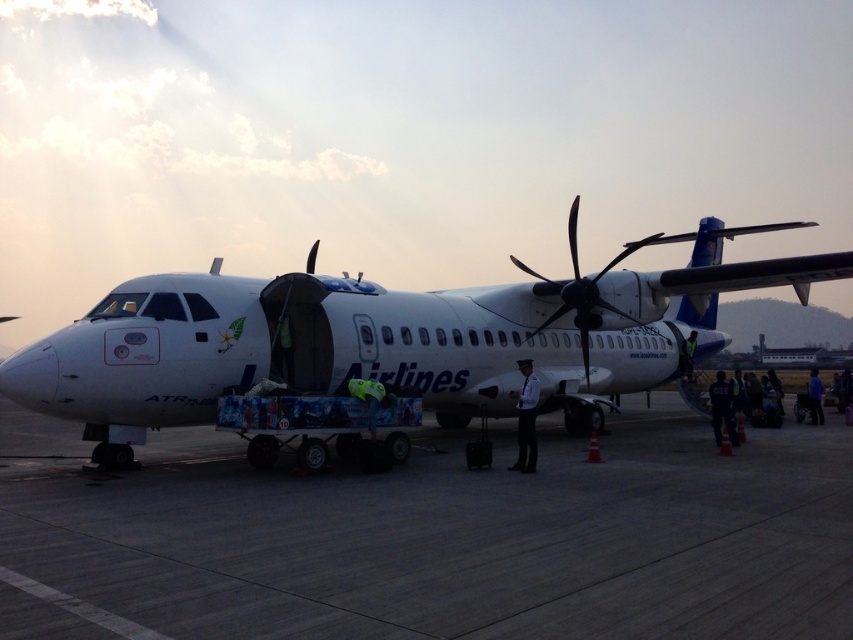
Which of these two, concrete tarmac at center or white matte airplane at center, stands taller?

Standing taller between the two is white matte airplane at center.

Is point (643, 516) closer to viewer compared to point (161, 401)?

Yes, it is.

Where is `concrete tarmac at center`? Image resolution: width=853 pixels, height=640 pixels. concrete tarmac at center is located at coordinates (465, 541).

Can you confirm if concrete tarmac at center is wider than black metallic propeller at center?

Yes.

Can you confirm if concrete tarmac at center is positioned below black metallic propeller at center?

Yes.

Does point (213, 490) come behind point (575, 224)?

No, it is in front of (575, 224).

The image size is (853, 640). In order to click on concrete tarmac at center in this screenshot , I will do `click(465, 541)`.

Between white matte airplane at center and black metallic propeller at center, which one appears on the right side from the viewer's perspective?

black metallic propeller at center is more to the right.

Is white matte airplane at center thinner than black metallic propeller at center?

Incorrect, white matte airplane at center's width is not less than black metallic propeller at center's.

Between point (316, 307) and point (573, 307), which one is positioned behind?

Positioned behind is point (573, 307).

Image resolution: width=853 pixels, height=640 pixels. In order to click on white matte airplane at center in this screenshot , I will do `click(386, 339)`.